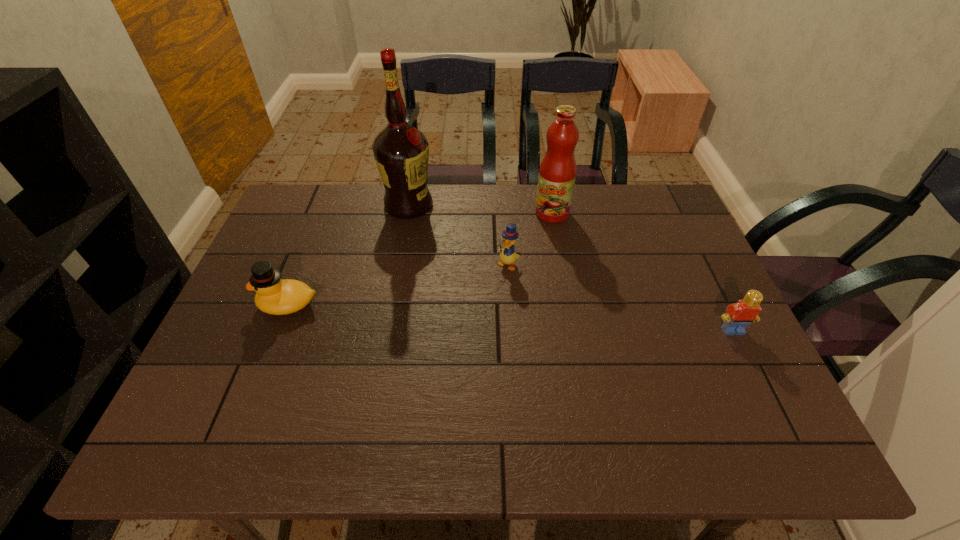
You are a GUI agent. You are given a task and a screenshot of the screen. Output one action in this format:
    pyautogui.click(x=<x>, y=<y>)
    Task: Click on the second closest object relative to the duck
    This screenshot has height=540, width=960.
    Given the screenshot: What is the action you would take?
    pyautogui.click(x=507, y=256)